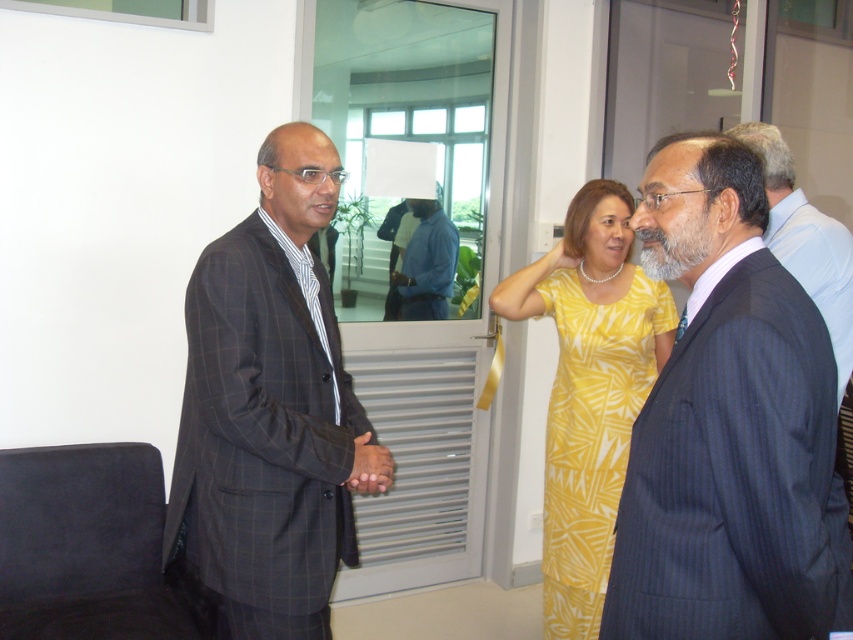
You are an observer standing in the room. You notice the blue cotton shirt at center and the smooth skin hand at center. Which object is taller?

The blue cotton shirt at center is taller than the smooth skin hand at center.

You are organizing a photoshoot and need to arrange two outfits in the center of the frame. The yellow printed dress at center and the blue cotton shirt at center must be placed side by side. Based on their sizes, which outfit should be positioned on the left to ensure they both fit within the frame without overlapping?

The yellow printed dress at center is wider than the blue cotton shirt at center. To fit both outfits side by side in the frame without overlapping, the narrower blue cotton shirt at center should be placed on the left, allowing the wider yellow printed dress at center to occupy more space on the right.